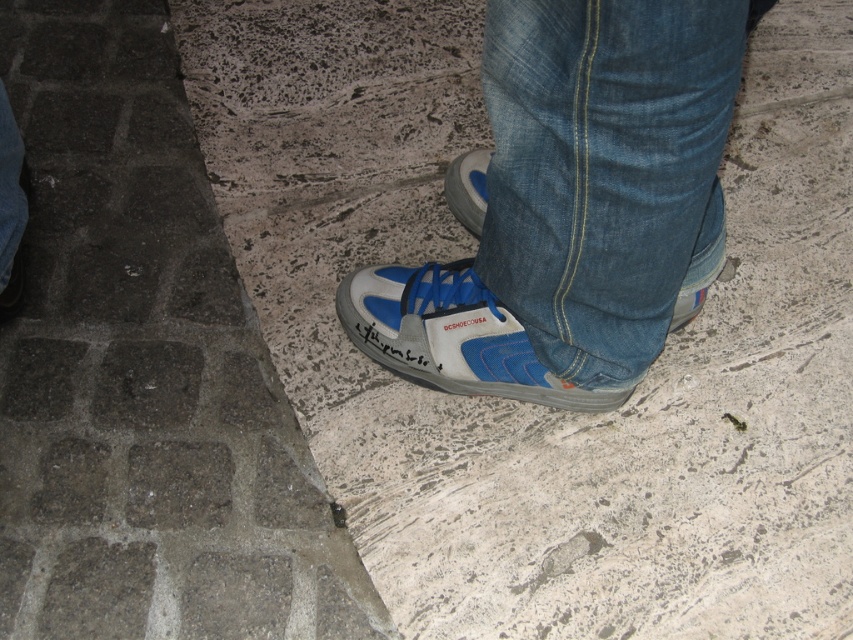
Does blue synthetic shoe at center lie in front of blue synthetic shoe at lower center?

Yes, it is.

Between point (440, 364) and point (480, 189), which one is positioned in front?

Point (440, 364) is more forward.

The image size is (853, 640). I want to click on blue synthetic shoe at center, so click(x=451, y=336).

Does denim at center appear over blue synthetic shoe at center?

Indeed, denim at center is positioned over blue synthetic shoe at center.

Describe the element at coordinates (605, 170) in the screenshot. I see `denim at center` at that location.

Identify the location of denim at center. (605, 170).

Can you confirm if gray stone pavement at lower left is positioned to the left of blue synthetic shoe at lower center?

Indeed, gray stone pavement at lower left is positioned on the left side of blue synthetic shoe at lower center.

Is gray stone pavement at lower left smaller than blue synthetic shoe at lower center?

Incorrect, gray stone pavement at lower left is not smaller in size than blue synthetic shoe at lower center.

Does point (173, 371) come behind point (469, 186)?

That is False.

Find the location of a particular element. gray stone pavement at lower left is located at coordinates (144, 371).